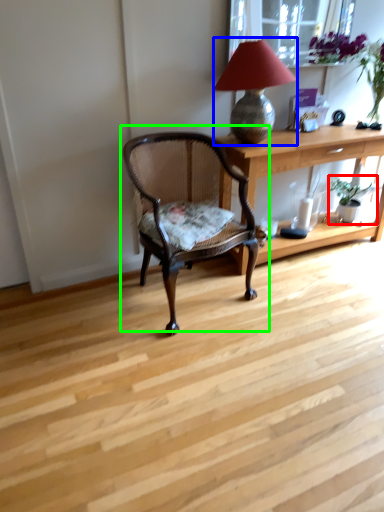
Question: Which is nearer to the houseplant (highlighted by a red box)? lamp (highlighted by a blue box) or chair (highlighted by a green box).

Choices:
 (A) lamp
 (B) chair

Answer: (A)